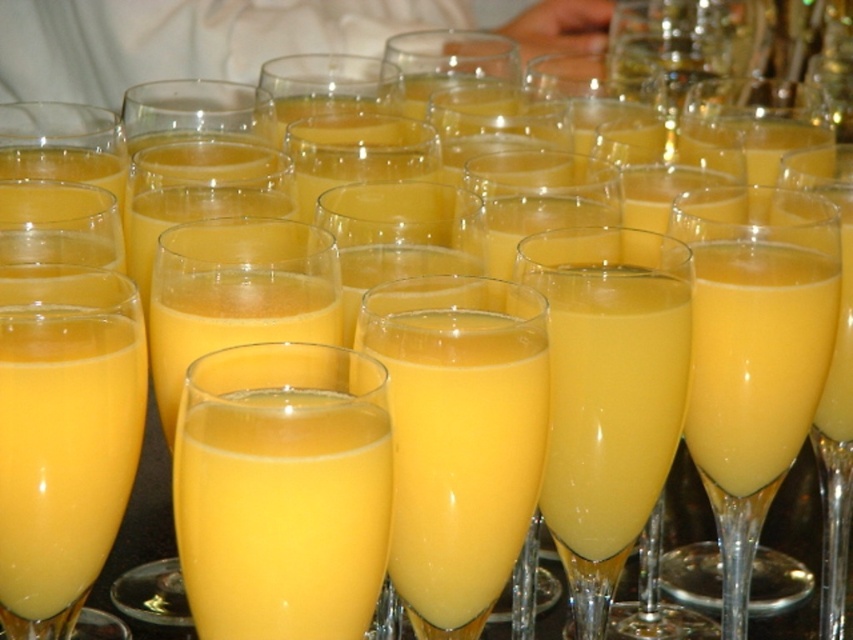
Question: Does translucent glass flute at center have a smaller size compared to yellow translucent glass at center?

Choices:
 (A) yes
 (B) no

Answer: (B)

Question: Which object appears closest to the camera in this image?

Choices:
 (A) yellow translucent glass at center
 (B) translucent glass flute at center

Answer: (A)

Question: Which object is farther from the camera taking this photo?

Choices:
 (A) yellow translucent glass at center
 (B) translucent glass flute at center

Answer: (B)

Question: Is translucent glass flute at center wider than yellow translucent glass at center?

Choices:
 (A) yes
 (B) no

Answer: (A)

Question: Is translucent glass flute at center further to camera compared to yellow translucent glass at center?

Choices:
 (A) yes
 (B) no

Answer: (A)

Question: Which of the following is the closest to the observer?

Choices:
 (A) translucent glass flute at center
 (B) yellow translucent glass at center

Answer: (B)